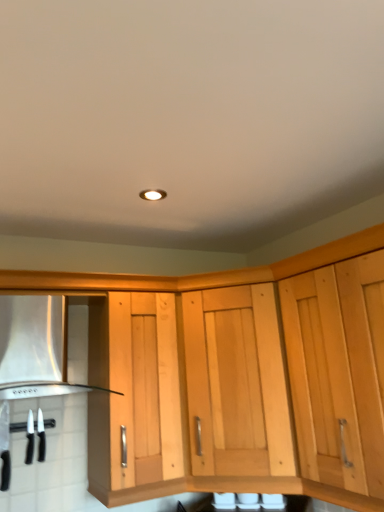
What is the approximate height of natural wood cabinet at center?

The height of natural wood cabinet at center is 34.37 inches.

Where is `natural wood cabinet at center`? natural wood cabinet at center is located at coordinates (236, 383).

The height and width of the screenshot is (512, 384). Identify the location of matte white recessed light at center. (153, 195).

This screenshot has width=384, height=512. What are the coordinates of `black plastic knives at lower left, marked as the second kitchen appliance in a right-to-left arrangement` in the screenshot? It's located at (5, 446).

Is matte white recessed light at center turned away from satin silver vent at lower left?

No, matte white recessed light at center is not facing away from satin silver vent at lower left.

Where is `vent located in front of the matte white recessed light at center`? This screenshot has height=512, width=384. vent located in front of the matte white recessed light at center is located at coordinates (34, 348).

From a real-world perspective, which object rests below the other?

satin silver vent at lower left, from a real-world perspective.

Visually, is natural wood cabinet at center positioned to the left or to the right of black plastic knife at lower left, placed as the second kitchen appliance when sorted from left to right?

natural wood cabinet at center is positioned on black plastic knife at lower left, placed as the second kitchen appliance when sorted from left to right,'s right side.

Which is in front, point (284, 467) or point (40, 429)?

Point (284, 467)

From a real-world perspective, is natural wood cabinet at center on top of black plastic knife at lower left, placed as the second kitchen appliance when sorted from left to right?

Correct, in the physical world, natural wood cabinet at center is higher than black plastic knife at lower left, placed as the second kitchen appliance when sorted from left to right.

Can you confirm if natural wood cabinet at center is taller than black plastic knife at lower left, the 1th kitchen appliance from the right?

Yes, natural wood cabinet at center is taller than black plastic knife at lower left, the 1th kitchen appliance from the right.

Considering the sizes of objects black plastic knife at lower left, placed as the second kitchen appliance when sorted from left to right, and satin silver vent at lower left in the image provided, who is thinner, black plastic knife at lower left, placed as the second kitchen appliance when sorted from left to right, or satin silver vent at lower left?

With smaller width is black plastic knife at lower left, placed as the second kitchen appliance when sorted from left to right.

Between point (37, 433) and point (80, 390), which one is positioned in front?

Point (37, 433)

Are black plastic knife at lower left, placed as the second kitchen appliance when sorted from left to right, and satin silver vent at lower left located far from each other?

No, black plastic knife at lower left, placed as the second kitchen appliance when sorted from left to right, is in close proximity to satin silver vent at lower left.

From the image's perspective, is black plastic knife at lower left, placed as the second kitchen appliance when sorted from left to right, above or below satin silver vent at lower left?

Based on their image positions, black plastic knife at lower left, placed as the second kitchen appliance when sorted from left to right, is located beneath satin silver vent at lower left.

In terms of height, does satin silver vent at lower left look taller or shorter compared to black plastic knife at lower left, placed as the second kitchen appliance when sorted from left to right?

Considering their sizes, satin silver vent at lower left has more height than black plastic knife at lower left, placed as the second kitchen appliance when sorted from left to right.

Can you confirm if satin silver vent at lower left is bigger than black plastic knife at lower left, the 1th kitchen appliance from the right?

Correct, satin silver vent at lower left is larger in size than black plastic knife at lower left, the 1th kitchen appliance from the right.

How many degrees apart are the facing directions of satin silver vent at lower left and black plastic knife at lower left, the 1th kitchen appliance from the right?

0.167 degrees.

Would you say satin silver vent at lower left is a long distance from black plastic knife at lower left, placed as the second kitchen appliance when sorted from left to right?

satin silver vent at lower left is near black plastic knife at lower left, placed as the second kitchen appliance when sorted from left to right, not far away.

From a real-world perspective, is matte white recessed light at center under black plastic knife at lower left, the 1th kitchen appliance from the right?

Incorrect, from a real-world perspective, matte white recessed light at center is higher than black plastic knife at lower left, the 1th kitchen appliance from the right.

Can you see matte white recessed light at center touching black plastic knife at lower left, the 1th kitchen appliance from the right?

No.

Between matte white recessed light at center and black plastic knife at lower left, placed as the second kitchen appliance when sorted from left to right, which one has larger size?

Bigger between the two is black plastic knife at lower left, placed as the second kitchen appliance when sorted from left to right.

Does matte white recessed light at center have a greater height compared to black plastic knife at lower left, placed as the second kitchen appliance when sorted from left to right?

Incorrect, the height of matte white recessed light at center is not larger of that of black plastic knife at lower left, placed as the second kitchen appliance when sorted from left to right.

From the image's perspective, is matte white recessed light at center above black plastic knives at lower left, marked as the second kitchen appliance in a right-to-left arrangement?

Correct, matte white recessed light at center appears higher than black plastic knives at lower left, marked as the second kitchen appliance in a right-to-left arrangement, in the image.

Is matte white recessed light at center in front of black plastic knives at lower left, marked as the second kitchen appliance in a right-to-left arrangement?

Yes, it is in front of black plastic knives at lower left, marked as the second kitchen appliance in a right-to-left arrangement.

Is matte white recessed light at center beside black plastic knives at lower left, marked as the second kitchen appliance in a right-to-left arrangement?

matte white recessed light at center is not next to black plastic knives at lower left, marked as the second kitchen appliance in a right-to-left arrangement, and they're not touching.

Can you confirm if matte white recessed light at center is wider than black plastic knives at lower left, which is counted as the 1th kitchen appliance, starting from the left?

Yes, matte white recessed light at center is wider than black plastic knives at lower left, which is counted as the 1th kitchen appliance, starting from the left.

Which object is positioned more to the left, black plastic knives at lower left, which is counted as the 1th kitchen appliance, starting from the left, or satin silver vent at lower left?

black plastic knives at lower left, which is counted as the 1th kitchen appliance, starting from the left, is more to the left.

Is black plastic knives at lower left, marked as the second kitchen appliance in a right-to-left arrangement, surrounding satin silver vent at lower left?

No.

Which of these two, black plastic knives at lower left, marked as the second kitchen appliance in a right-to-left arrangement, or satin silver vent at lower left, stands shorter?

black plastic knives at lower left, marked as the second kitchen appliance in a right-to-left arrangement.

Find the location of a particular element. This screenshot has height=512, width=384. vent in front of the matte white recessed light at center is located at coordinates (34, 348).

Find the location of `the 1st kitchen appliance to the left of the natural wood cabinet at center, counting from the anchor's position`. the 1st kitchen appliance to the left of the natural wood cabinet at center, counting from the anchor's position is located at coordinates (41, 437).

From the picture: Estimate the real-world distances between objects in this image. Which object is further from natural wood cabinet at center, black plastic knives at lower left, marked as the second kitchen appliance in a right-to-left arrangement, or black plastic knife at lower left, placed as the second kitchen appliance when sorted from left to right?

black plastic knives at lower left, marked as the second kitchen appliance in a right-to-left arrangement, lies further to natural wood cabinet at center than the other object.

From the image, which object appears to be farther from matte white recessed light at center, black plastic knives at lower left, marked as the second kitchen appliance in a right-to-left arrangement, or black plastic knife at lower left, placed as the second kitchen appliance when sorted from left to right?

black plastic knives at lower left, marked as the second kitchen appliance in a right-to-left arrangement, is further to matte white recessed light at center.

Considering their positions, is black plastic knife at lower left, the 1th kitchen appliance from the right, positioned further to black plastic knives at lower left, marked as the second kitchen appliance in a right-to-left arrangement, than satin silver vent at lower left?

satin silver vent at lower left lies further to black plastic knives at lower left, marked as the second kitchen appliance in a right-to-left arrangement, than the other object.

From the image, which object appears to be farther from natural wood cabinet at center, satin silver vent at lower left or black plastic knives at lower left, which is counted as the 1th kitchen appliance, starting from the left?

Based on the image, black plastic knives at lower left, which is counted as the 1th kitchen appliance, starting from the left, appears to be further to natural wood cabinet at center.

When comparing their distances from matte white recessed light at center, does natural wood cabinet at center or black plastic knives at lower left, which is counted as the 1th kitchen appliance, starting from the left, seem further?

black plastic knives at lower left, which is counted as the 1th kitchen appliance, starting from the left.

From the image, which object appears to be nearer to black plastic knives at lower left, marked as the second kitchen appliance in a right-to-left arrangement, satin silver vent at lower left or matte white recessed light at center?

satin silver vent at lower left is positioned closer to the anchor black plastic knives at lower left, marked as the second kitchen appliance in a right-to-left arrangement.

Based on their spatial positions, is natural wood cabinet at center or black plastic knife at lower left, the 1th kitchen appliance from the right, closer to black plastic knives at lower left, marked as the second kitchen appliance in a right-to-left arrangement?

black plastic knife at lower left, the 1th kitchen appliance from the right, lies closer to black plastic knives at lower left, marked as the second kitchen appliance in a right-to-left arrangement, than the other object.

When comparing their distances from satin silver vent at lower left, does black plastic knives at lower left, marked as the second kitchen appliance in a right-to-left arrangement, or matte white recessed light at center seem closer?

Among the two, black plastic knives at lower left, marked as the second kitchen appliance in a right-to-left arrangement, is located nearer to satin silver vent at lower left.

You are a GUI agent. You are given a task and a screenshot of the screen. Output one action in this format:
    pyautogui.click(x=<x>, y=<y>)
    Task: Click on the vent between matte white recessed light at center and natural wood cabinet at center vertically
    The image size is (384, 512).
    Given the screenshot: What is the action you would take?
    pyautogui.click(x=34, y=348)

In order to click on kitchen appliance positioned between satin silver vent at lower left and black plastic knife at lower left, the 1th kitchen appliance from the right, from near to far in this screenshot , I will do `click(5, 446)`.

Identify the location of vent between matte white recessed light at center and black plastic knife at lower left, placed as the second kitchen appliance when sorted from left to right, vertically. This screenshot has width=384, height=512. (34, 348).

Locate an element on the screen. The width and height of the screenshot is (384, 512). kitchen appliance between black plastic knives at lower left, which is counted as the 1th kitchen appliance, starting from the left, and natural wood cabinet at center is located at coordinates (41, 437).